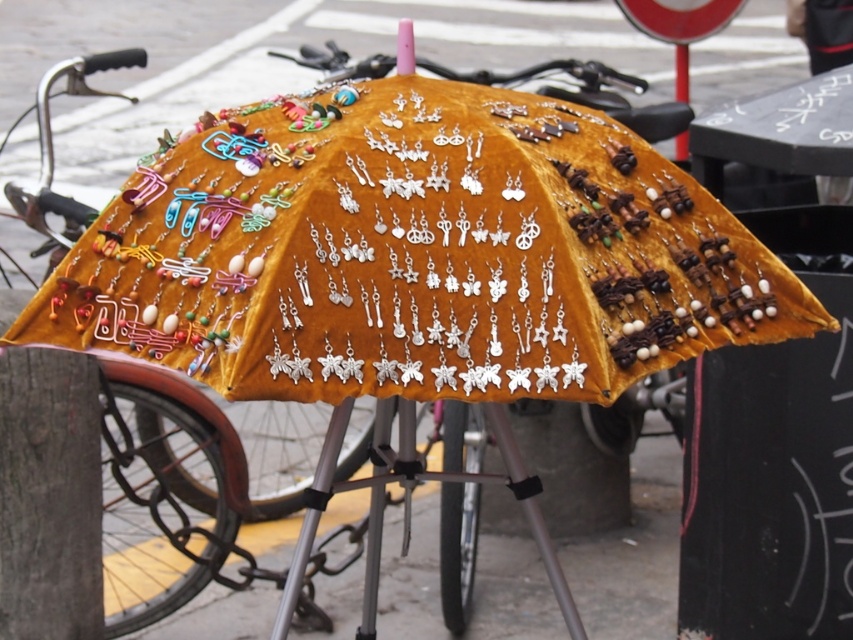
Question: Is velvet umbrella at center positioned before black plastic pole at upper right?

Choices:
 (A) yes
 (B) no

Answer: (A)

Question: Which of the following is the farthest from the observer?

Choices:
 (A) (616, 259)
 (B) (682, 88)

Answer: (B)

Question: Can you confirm if velvet umbrella at center is smaller than black plastic pole at upper right?

Choices:
 (A) yes
 (B) no

Answer: (B)

Question: Can you confirm if velvet umbrella at center is positioned to the left of black plastic pole at upper right?

Choices:
 (A) no
 (B) yes

Answer: (B)

Question: Which of the following is the closest to the observer?

Choices:
 (A) velvet umbrella at center
 (B) black plastic pole at upper right

Answer: (A)